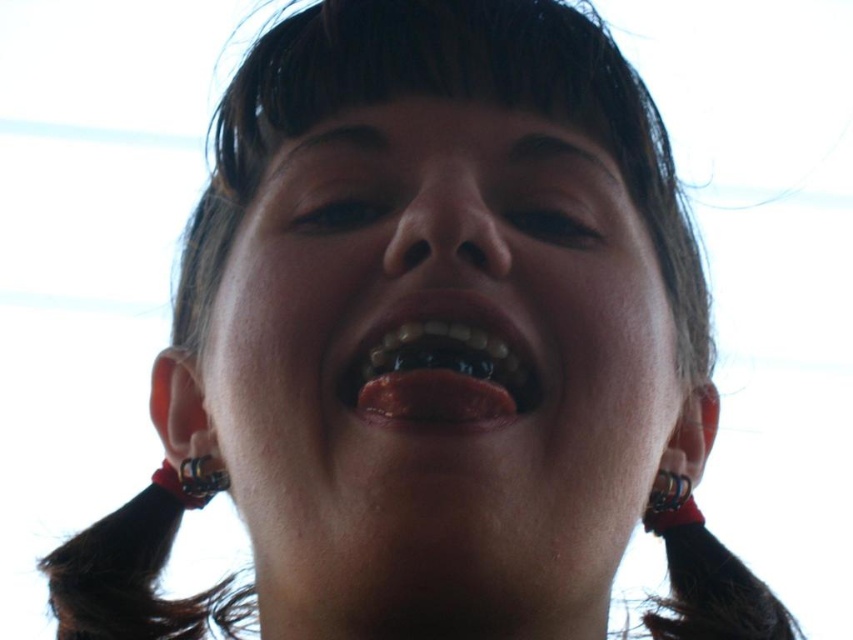
Who is lower down, shiny white teeth at center or silver metallic ring at lower left?

silver metallic ring at lower left is below.

Does shiny white teeth at center have a lesser height compared to silver metallic ring at lower left?

Incorrect, shiny white teeth at center's height does not fall short of silver metallic ring at lower left's.

The height and width of the screenshot is (640, 853). Find the location of `shiny white teeth at center`. shiny white teeth at center is located at coordinates (440, 372).

Is smooth skin face at center bigger than silver metallic ring at lower left?

Yes, smooth skin face at center is bigger than silver metallic ring at lower left.

Is smooth skin face at center positioned in front of silver metallic ring at lower left?

Yes.

The height and width of the screenshot is (640, 853). Describe the element at coordinates (442, 369) in the screenshot. I see `smooth skin face at center` at that location.

Where is `smooth skin face at center`? smooth skin face at center is located at coordinates (442, 369).

Can you confirm if smooth skin face at center is bigger than shiny white teeth at center?

Yes, smooth skin face at center is bigger than shiny white teeth at center.

Is point (270, 476) positioned before point (488, 333)?

No, (270, 476) is further to viewer.

At what (x,y) coordinates should I click in order to perform the action: click on smooth skin face at center. Please return your answer as a coordinate pair (x, y). This screenshot has width=853, height=640. Looking at the image, I should click on (442, 369).